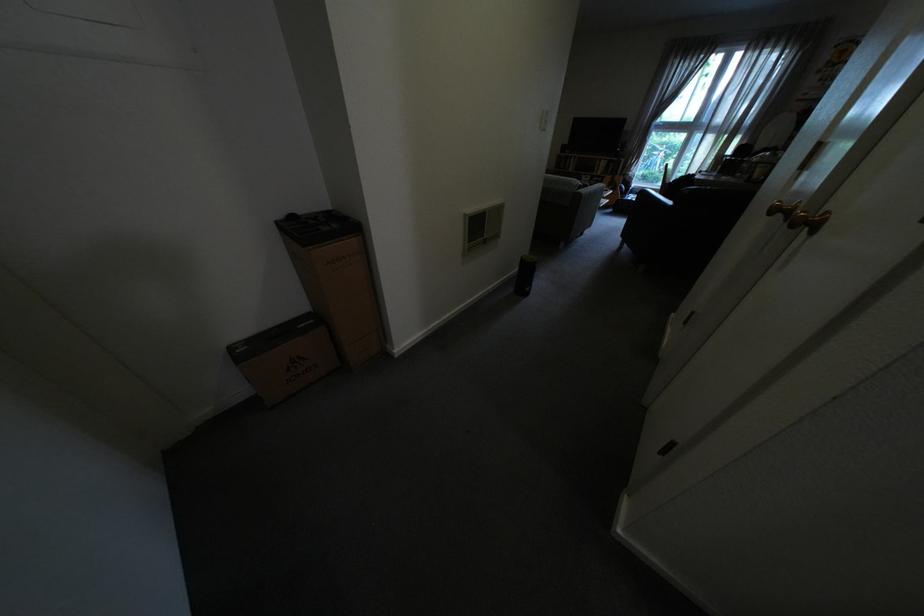
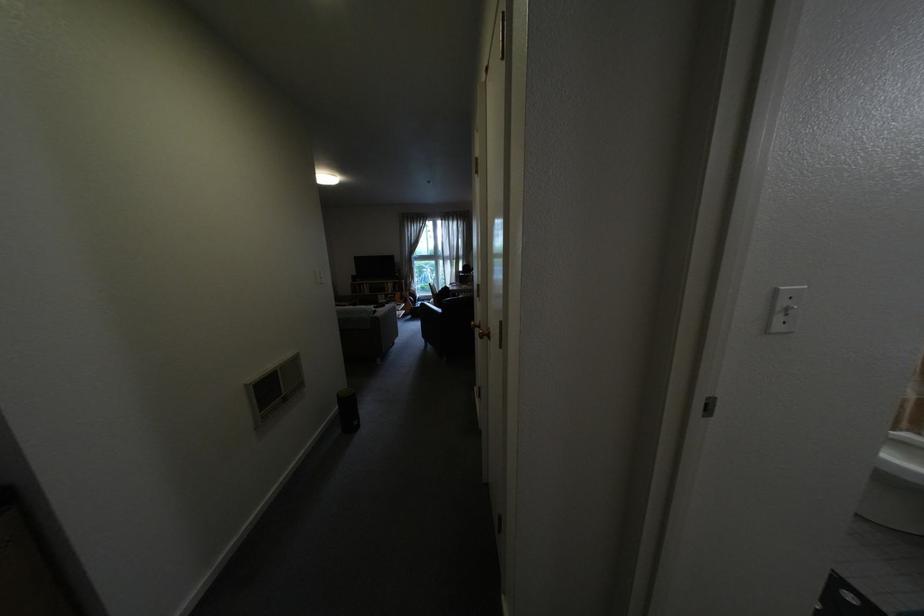
Question: The camera is either moving clockwise (left) or counter-clockwise (right) around the object. The first image is from the beginning of the video and the second image is from the end. Is the camera moving left or right when shooting the video?

Choices:
 (A) Left
 (B) Right

Answer: (A)